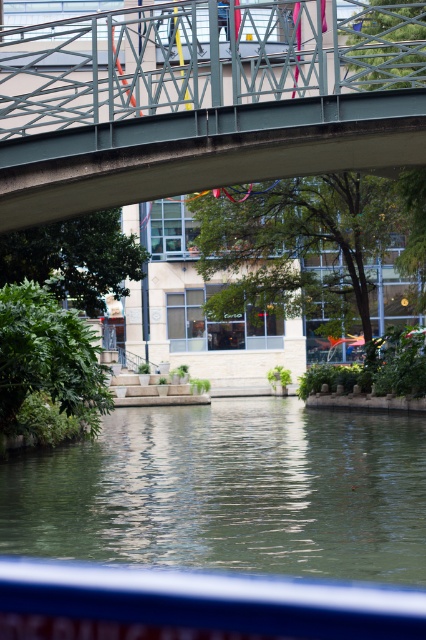
Question: Does metallic gray bridge at upper center appear on the left side of green smooth water at center?

Choices:
 (A) no
 (B) yes

Answer: (B)

Question: Considering the relative positions of metallic gray bridge at upper center and green smooth water at center in the image provided, where is metallic gray bridge at upper center located with respect to green smooth water at center?

Choices:
 (A) left
 (B) right

Answer: (A)

Question: Where is metallic gray bridge at upper center located in relation to green smooth water at center in the image?

Choices:
 (A) left
 (B) right

Answer: (A)

Question: Which point is closer to the camera?

Choices:
 (A) 74,184
 (B) 184,536

Answer: (B)

Question: Which point is farther to the camera?

Choices:
 (A) (222, 401)
 (B) (298, 168)

Answer: (A)